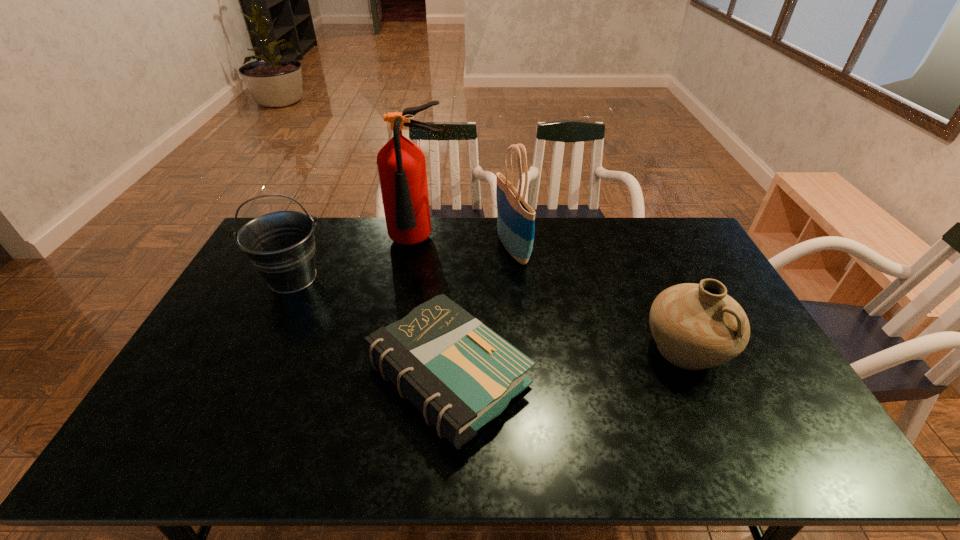
This screenshot has width=960, height=540. I want to click on vacant space that is in between the fourth tallest object and the tote bag, so click(x=599, y=299).

Locate an element on the screen. The height and width of the screenshot is (540, 960). empty space between the third shortest object and the fourth tallest object is located at coordinates 490,314.

Choose which object is the fourth nearest neighbor to the second tallest object. Please provide its 2D coordinates. Your answer should be formatted as a tuple, i.e. [(x, y)], where the tuple contains the x and y coordinates of a point satisfying the conditions above.

[(280, 245)]

The height and width of the screenshot is (540, 960). Identify the location of object that stands as the second closest to the pottery. coord(515,218).

What are the coordinates of `vacant region that satisfies the following two spatial constraints: 1. at the nozzle of the shortest object; 2. on the right side of the fire extinguisher` in the screenshot? It's located at (394, 376).

This screenshot has height=540, width=960. I want to click on free location that satisfies the following two spatial constraints: 1. at the nozzle of the second tallest object; 2. on the right side of the fire extinguisher, so click(417, 248).

Image resolution: width=960 pixels, height=540 pixels. I want to click on free space that satisfies the following two spatial constraints: 1. at the nozzle of the tallest object; 2. on the left side of the rightmost object, so click(x=398, y=349).

Locate an element on the screen. The width and height of the screenshot is (960, 540). free space that satisfies the following two spatial constraints: 1. at the nozzle of the fire extinguisher; 2. on the right side of the second shortest object is located at coordinates (398, 349).

This screenshot has width=960, height=540. What are the coordinates of `free location that satisfies the following two spatial constraints: 1. at the nozzle of the pottery; 2. on the right side of the tallest object` in the screenshot? It's located at tap(398, 349).

Locate an element on the screen. free region that satisfies the following two spatial constraints: 1. on the back side of the second tallest object; 2. on the right side of the shortest object is located at coordinates (456, 248).